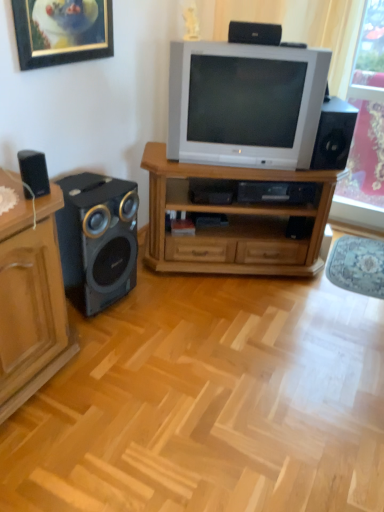
Question: Is point (38, 16) positioned closer to the camera than point (375, 75)?

Choices:
 (A) closer
 (B) farther

Answer: (A)

Question: In terms of size, does gold-framed picture at upper left appear bigger or smaller than pink floral curtain at right?

Choices:
 (A) big
 (B) small

Answer: (B)

Question: Which object is positioned closest to the wooden tv stand at center?

Choices:
 (A) metallic black speaker at left, which is the first loudspeaker in bottom-to-top order
 (B) white plastic television at center
 (C) black plastic speaker at right, the fourth loudspeaker positioned from the left
 (D) gold-framed picture at upper left
 (E) black plastic speaker at upper center, placed as the third loudspeaker when sorted from left to right

Answer: (B)

Question: Based on their relative distances, which object is farther from the black plastic speaker at right, the fourth loudspeaker positioned from the left?

Choices:
 (A) pink floral curtain at right
 (B) black plastic speaker at upper center, positioned as the second loudspeaker in right-to-left order
 (C) wooden tv stand at center
 (D) metallic black speaker at left, placed as the second loudspeaker when sorted from left to right
 (E) gold-framed picture at upper left

Answer: (E)